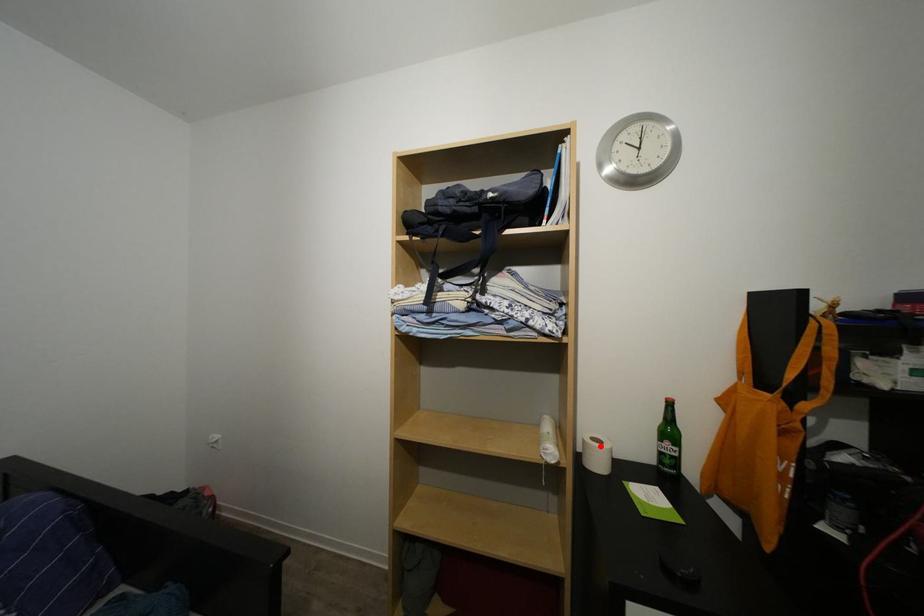
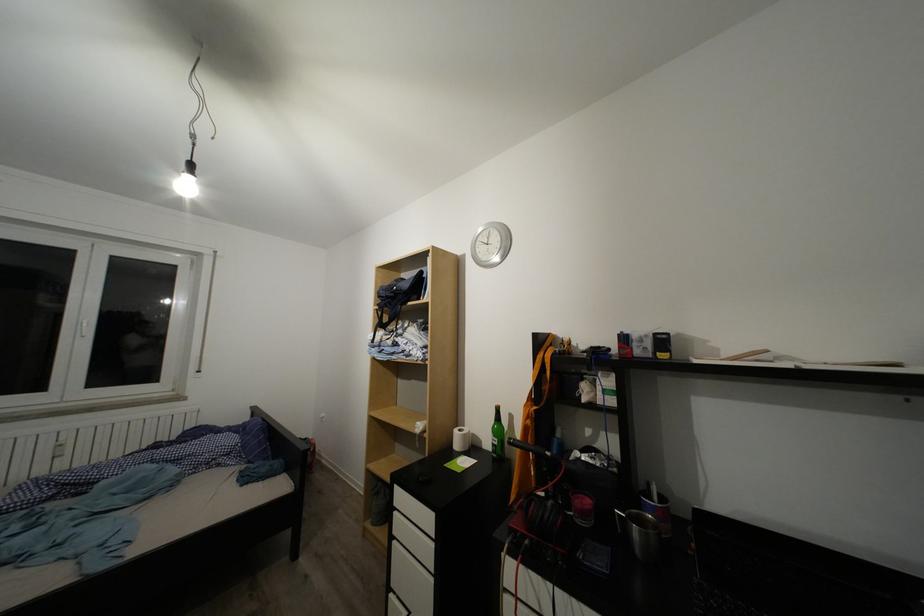
Where in the second image is the point corresponding to the highlighted location from the first image?

(468, 436)